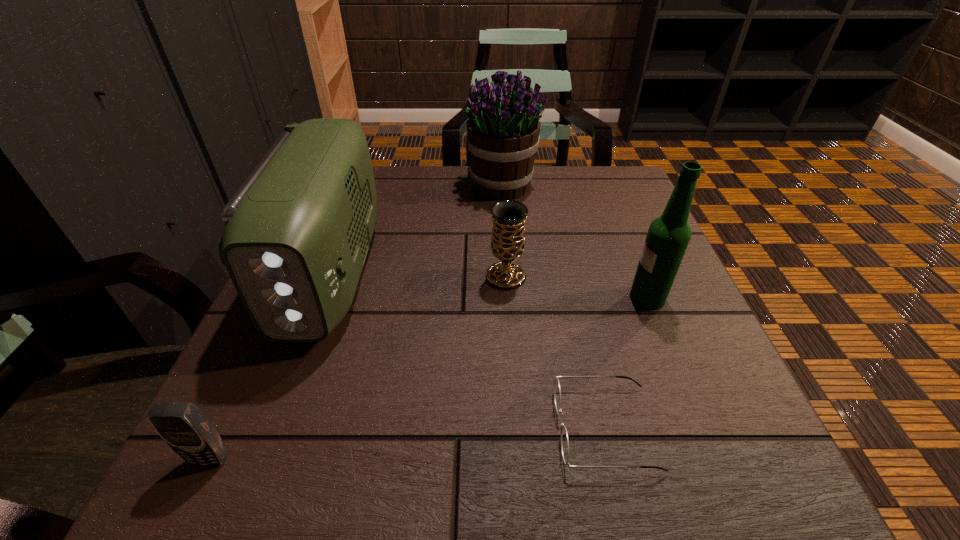
Locate an element on the screen. The image size is (960, 540). vacant area between the fifth tallest object and the spectacles is located at coordinates (408, 443).

The width and height of the screenshot is (960, 540). What are the coordinates of `free space between the shortest object and the chalice` in the screenshot? It's located at (556, 352).

Find the location of a particular element. The height and width of the screenshot is (540, 960). vacant space that's between the spectacles and the chalice is located at coordinates (556, 352).

Image resolution: width=960 pixels, height=540 pixels. Identify the location of object identified as the fourth closest to the rightmost object. (297, 232).

Select which object is the closest to the shortest object. Please provide its 2D coordinates. Your answer should be formatted as a tuple, i.e. [(x, y)], where the tuple contains the x and y coordinates of a point satisfying the conditions above.

[(668, 236)]

Identify the location of vacant space that satisfies the following two spatial constraints: 1. on the front-facing side of the spectacles; 2. on the front face of the fifth tallest object. (612, 459).

Image resolution: width=960 pixels, height=540 pixels. What are the coordinates of `vacant position in the image that satisfies the following two spatial constraints: 1. on the label of the beer bottle; 2. on the front face of the cellular telephone` in the screenshot? It's located at (711, 459).

This screenshot has width=960, height=540. Identify the location of free location that satisfies the following two spatial constraints: 1. on the front-facing side of the third shortest object; 2. on the left side of the radio_receiver. (329, 276).